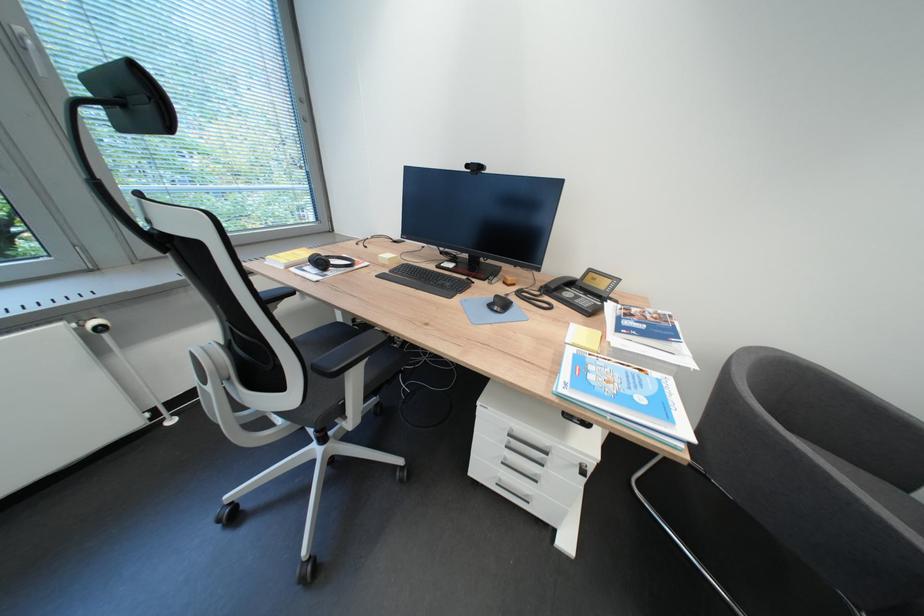
Find the location of a particular element. This screenshot has height=616, width=924. black chair headrest is located at coordinates (130, 98).